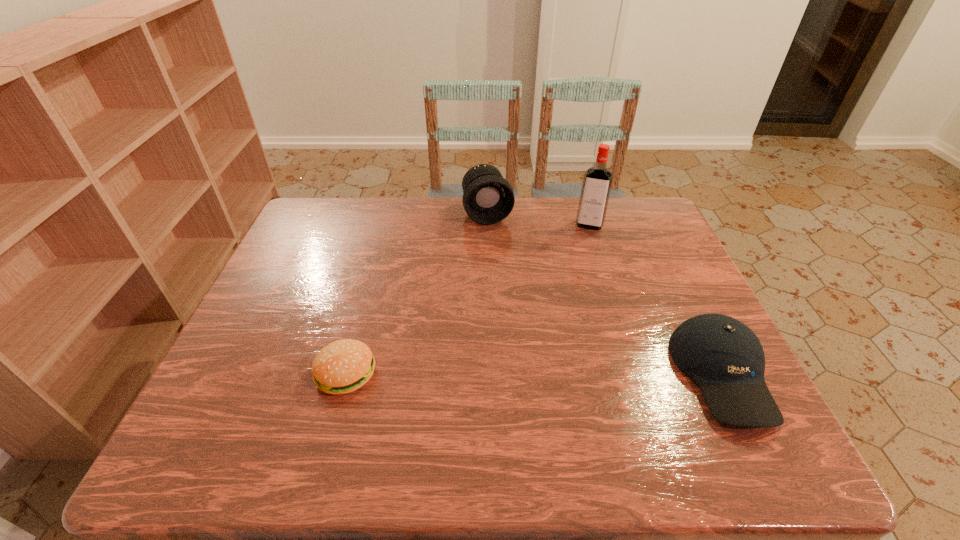
Locate an element on the screen. The width and height of the screenshot is (960, 540). free region located on the front and back of the tallest object is located at coordinates (566, 322).

Find the location of `vacant space located on the front and back of the tallest object`. vacant space located on the front and back of the tallest object is located at coordinates (569, 311).

Find the location of a particular element. The image size is (960, 540). vacant space located 0.080m at the front element of the second object from left to right is located at coordinates (498, 244).

Find the location of a particular element. The image size is (960, 540). free location located at the front element of the second object from left to right is located at coordinates (514, 289).

I want to click on free space located at the front element of the second object from left to right, so click(x=501, y=254).

You are a GUI agent. You are given a task and a screenshot of the screen. Output one action in this format:
    pyautogui.click(x=<x>, y=<y>)
    Task: Click on the vodka present at the far edge
    The image size is (960, 540).
    Given the screenshot: What is the action you would take?
    pyautogui.click(x=597, y=181)

Where is `telephoto lens that is at the far edge`? The image size is (960, 540). telephoto lens that is at the far edge is located at coordinates (488, 198).

Image resolution: width=960 pixels, height=540 pixels. I want to click on patty located at the near edge, so click(343, 366).

The image size is (960, 540). Find the location of `baseball cap at the near edge`. baseball cap at the near edge is located at coordinates (724, 357).

Image resolution: width=960 pixels, height=540 pixels. What are the coordinates of `object that is at the right edge` in the screenshot? It's located at (724, 357).